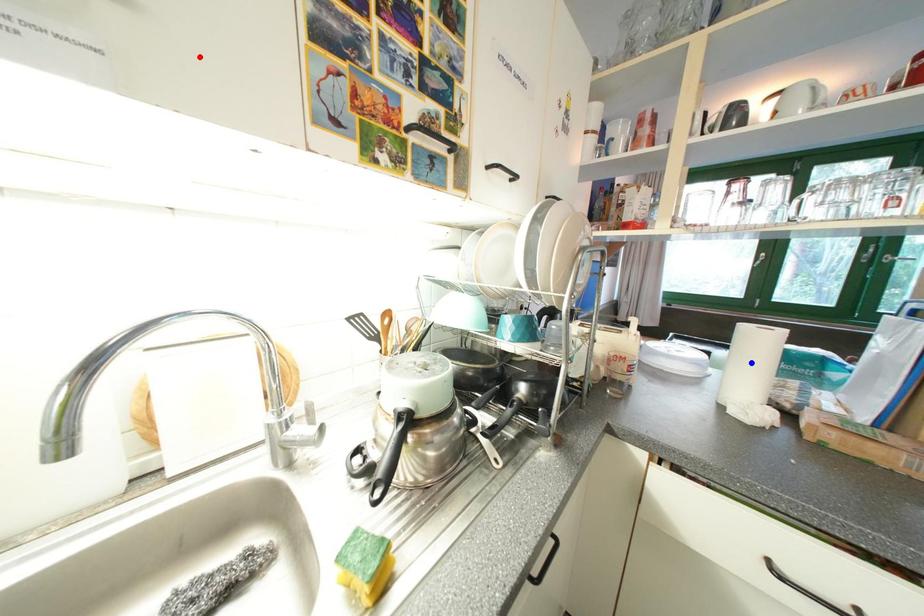
Question: In the image, two points are highlighted. Which point is nearer to the camera? Reply with the corresponding letter.

Choices:
 (A) blue point
 (B) red point

Answer: (B)